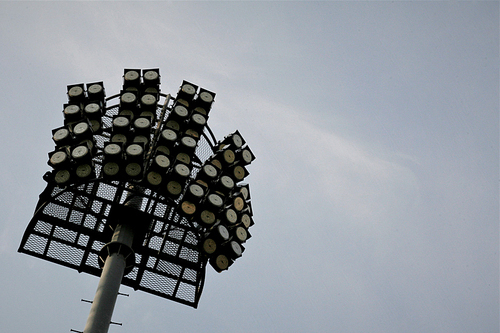
This screenshot has width=500, height=333. I want to click on lights that make up the bottom rows of each column, so click(x=61, y=176), click(x=83, y=170), click(x=110, y=168), click(x=133, y=167), click(x=153, y=177), click(x=172, y=188), click(x=188, y=208), click(x=206, y=216), click(x=209, y=244), click(x=221, y=263).